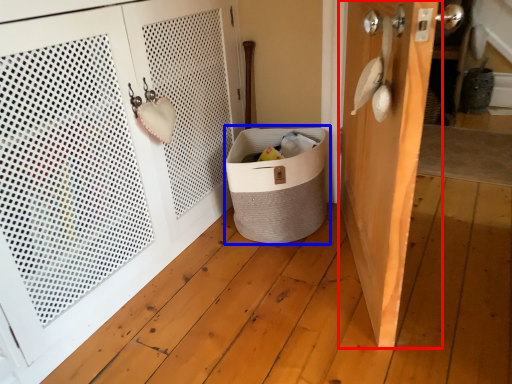
Question: Which object appears closest to the camera in this image, door (highlighted by a red box) or laundry basket (highlighted by a blue box)?

Choices:
 (A) door
 (B) laundry basket

Answer: (A)